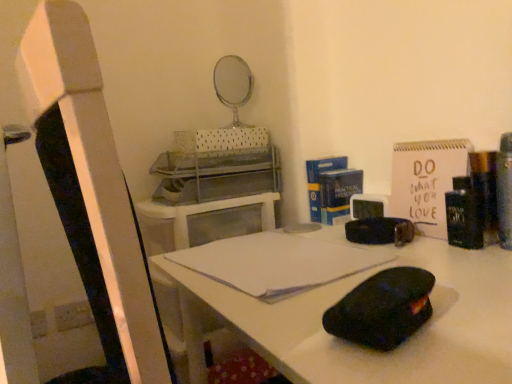
At what (x,y) coordinates should I click in order to perform the action: click on free spot above black matte desk at center (from a real-world perspective). Please return your answer as a coordinate pair (x, y). This screenshot has width=512, height=384. Looking at the image, I should click on (319, 265).